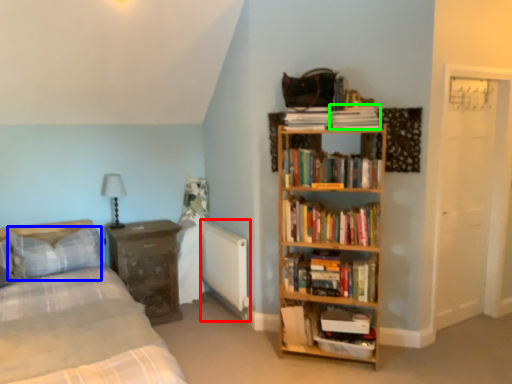
Question: Estimate the real-world distances between objects in this image. Which object is closer to radiator (highlighted by a red box), pillow (highlighted by a blue box) or paperback book (highlighted by a green box)?

Choices:
 (A) pillow
 (B) paperback book

Answer: (A)